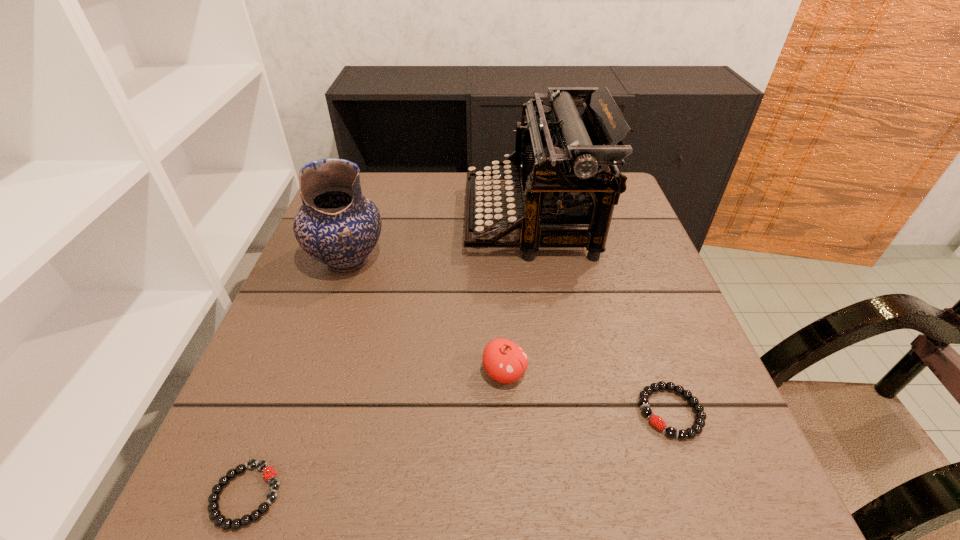
You are a GUI agent. You are given a task and a screenshot of the screen. Output one action in this format:
    pyautogui.click(x=<x>, y=<y>)
    Task: Click on the object situated at the far right corner
    The width and height of the screenshot is (960, 540).
    Given the screenshot: What is the action you would take?
    pyautogui.click(x=565, y=162)

This screenshot has height=540, width=960. I want to click on vacant space at the far edge of the desktop, so click(433, 174).

In the image, there is a desktop. Find the location of `vacant area at the near edge`. vacant area at the near edge is located at coordinates (568, 481).

Where is `free space at the left edge of the desktop`? Image resolution: width=960 pixels, height=540 pixels. free space at the left edge of the desktop is located at coordinates (308, 259).

Identify the location of vacant area at the right edge. [x=616, y=258].

I want to click on vacant point at the far left corner, so click(x=365, y=178).

Locate an element on the screen. This screenshot has height=540, width=960. free space between the right bracelet and the nearer bracelet is located at coordinates (459, 454).

Image resolution: width=960 pixels, height=540 pixels. What are the coordinates of `vacant space in between the nearest object and the tallest object` in the screenshot? It's located at (389, 357).

In order to click on vacant space in between the typewriter and the nearest object in this screenshot , I will do `click(389, 357)`.

Find the location of a particular element. The image size is (960, 540). free space between the apple and the farther bracelet is located at coordinates (588, 393).